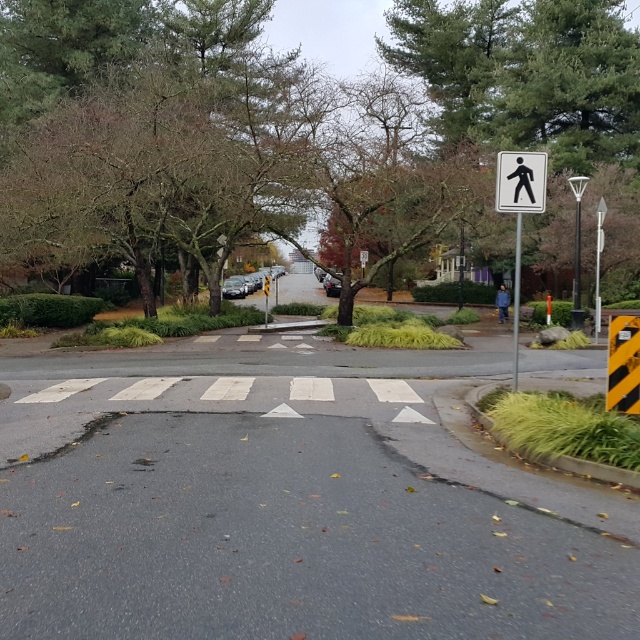
You are standing at the pedestrian crossing and looking towards the road. There are two points marked on the road surface, one at point coordinates point (0, 124) and the other at point coordinates point (612, 330). Which point is closer to your current position?

Point (0, 124) is further to the camera than point (612, 330), so the point closer to your current position is point (612, 330).

Based on the photo, you are standing at the point labeled as point [68,45] in the image. Looking towards the green leafy tree at upper center, which direction should you turn to face the pedestrian crossing sign on the right side of the image?

Since point [68,45] is the green leafy tree at upper center, you are already facing the pedestrian crossing sign on the right side of the image. Therefore, no turn is needed.

You are a delivery driver who needs to locate the pedestrian crossing sign in this urban scene. According to the map coordinates provided, where exactly is the black plastic pedestrian sign at upper right located?

The black plastic pedestrian sign at upper right is located at point (520,180).